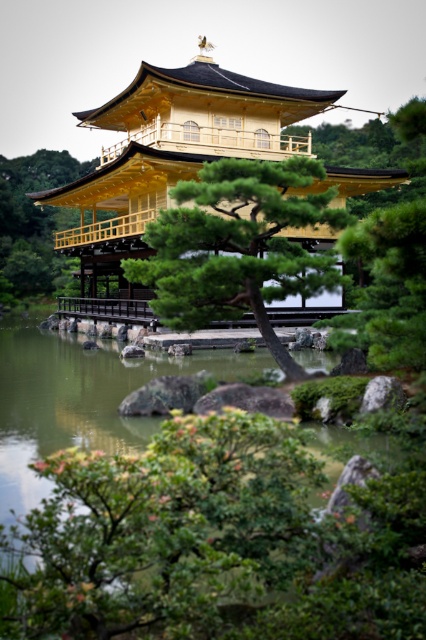
You are a visitor standing in the Japanese garden and want to take a photo of both the gold polished wood palace at center and the green textured tree at center. Which object should you position to your left to include both in the frame?

You should position the green textured tree at center to your left since the gold polished wood palace at center is on the right side of the green textured tree at center, allowing both to be captured in the frame.

You are standing in front of the Golden Pavilion and want to take a photo that includes both the point at coordinates point [206,284] and point [28,156]. Which point should you focus on first to ensure both are in focus?

You should focus on point [28,156] first because it is farther from the camera than point [206,284]. By focusing on the farther point, the closer point will also be within the depth of field.